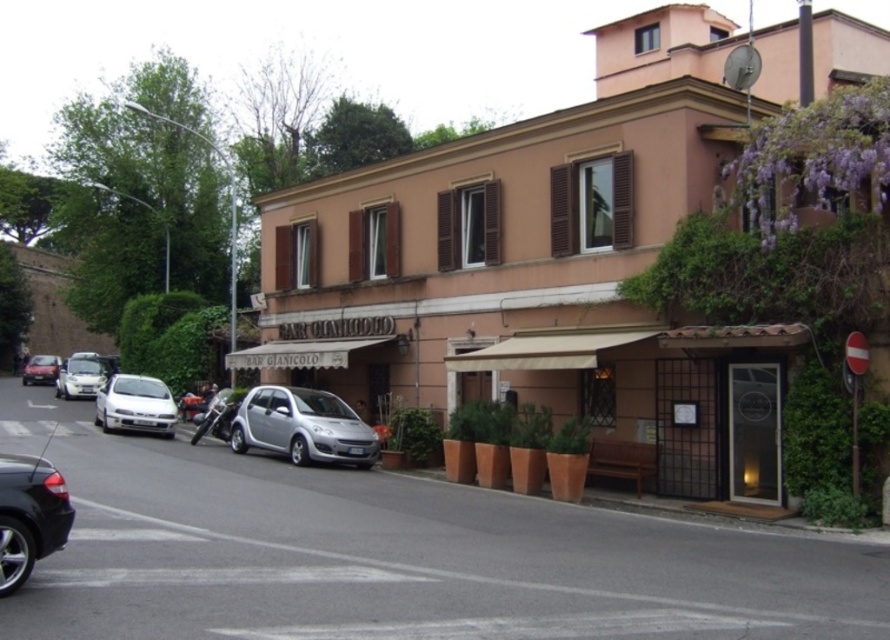
Question: Considering the real-world distances, which object is closest to the silver metallic car at left?

Choices:
 (A) shiny black sedan at lower left
 (B) silver metallic car at center

Answer: (B)

Question: Which object is farther from the camera taking this photo?

Choices:
 (A) silver metallic car at center
 (B) matte silver car at left
 (C) white matte car at center-left

Answer: (B)

Question: Does white matte car at center-left appear over silver metallic car at left?

Choices:
 (A) yes
 (B) no

Answer: (B)

Question: Is white matte car at center-left to the left of silver metallic car at left from the viewer's perspective?

Choices:
 (A) no
 (B) yes

Answer: (A)

Question: Among these objects, which one is farthest from the camera?

Choices:
 (A) matte silver car at left
 (B) shiny black sedan at lower left

Answer: (A)

Question: In this image, where is silver metallic car at center located relative to white matte car at center-left?

Choices:
 (A) below
 (B) above

Answer: (A)